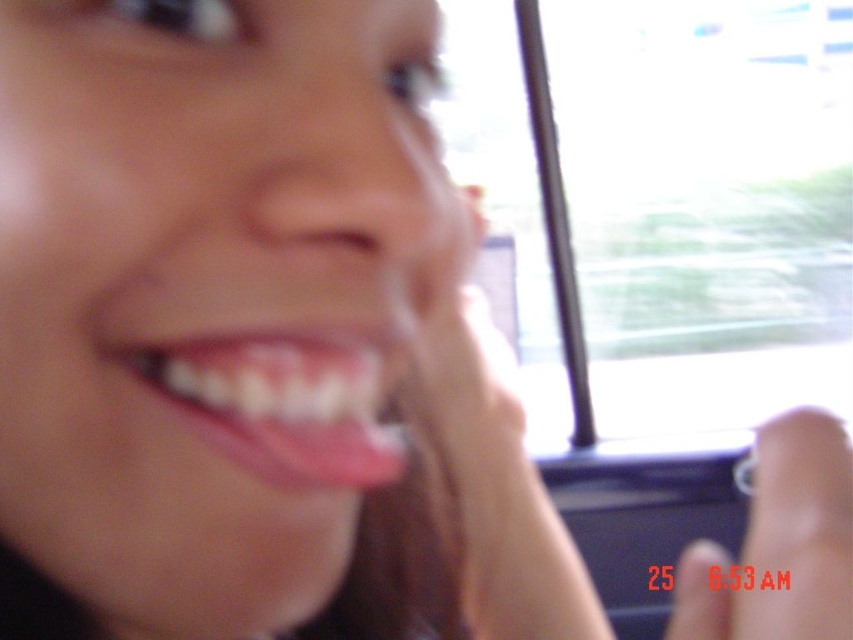
Question: Which object is positioned farthest from the smooth skin face at center?

Choices:
 (A) white glossy teeth at center
 (B) clear plastic finger at center

Answer: (A)

Question: Which point appears closest to the camera in this image?

Choices:
 (A) [827, 541]
 (B) [200, 381]

Answer: (A)

Question: Where is smooth skin face at center located in relation to white glossy teeth at center in the image?

Choices:
 (A) left
 (B) right

Answer: (B)

Question: Is the position of smooth skin face at center less distant than that of clear plastic finger at center?

Choices:
 (A) yes
 (B) no

Answer: (B)

Question: Is white glossy teeth at center closer to camera compared to clear plastic finger at center?

Choices:
 (A) yes
 (B) no

Answer: (B)

Question: Which of the following is the closest to the observer?

Choices:
 (A) smooth skin face at center
 (B) white glossy teeth at center
 (C) clear plastic finger at center

Answer: (C)